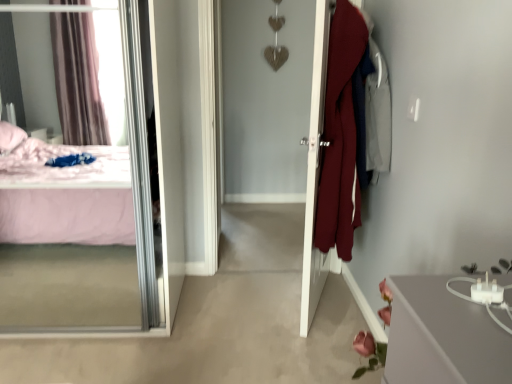
Image resolution: width=512 pixels, height=384 pixels. Identify the location of vacant space to the right of transparent glass mirror at left. coord(216,317).